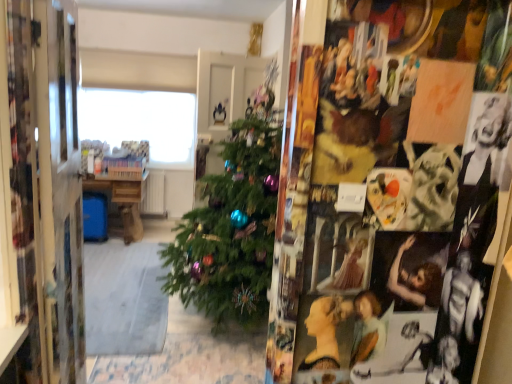
Based on the photo, measure the distance between point (138, 134) and camera.

16.27 feet.

Measure the distance between point (115,192) and camera.

The distance of point (115,192) from camera is 4.50 meters.

This screenshot has height=384, width=512. In order to click on transparent glass window at upper center in this screenshot , I will do `click(142, 122)`.

The image size is (512, 384). Find the location of `table behind the metallic silver mirror at left`. table behind the metallic silver mirror at left is located at coordinates (123, 200).

Would you say metallic silver mirror at left is a long distance from wooden table at center?

metallic silver mirror at left is positioned a significant distance from wooden table at center.

Considering the relative sizes of metallic silver mirror at left and wooden table at center in the image provided, is metallic silver mirror at left wider than wooden table at center?

In fact, metallic silver mirror at left might be narrower than wooden table at center.

From the image's perspective, between metallic silver mirror at left and wooden table at center, which one is located above?

metallic silver mirror at left, from the image's perspective.

Between wooden table at center and transparent glass window at upper center, which one has larger width?

wooden table at center.

In order to click on window in front of the wooden table at center in this screenshot , I will do `click(142, 122)`.

Who is smaller, wooden table at center or transparent glass window at upper center?

With smaller size is transparent glass window at upper center.

Is transparent glass window at upper center facing away from wooden table at center?

transparent glass window at upper center does not have its back to wooden table at center.

From the image's perspective, between transparent glass window at upper center and wooden table at center, who is located below?

wooden table at center, from the image's perspective.

Between transparent glass window at upper center and wooden table at center, which one appears on the right side from the viewer's perspective?

transparent glass window at upper center.

At what (x,y) coordinates should I click in order to perform the action: click on table below the transparent glass window at upper center (from the image's perspective). Please return your answer as a coordinate pair (x, y). This screenshot has height=384, width=512. Looking at the image, I should click on (123, 200).

From a real-world perspective, which object stands above the other?

From a 3D spatial view, transparent glass window at upper center is above.

Is metallic silver mirror at left positioned far away from transparent glass window at upper center?

Yes, metallic silver mirror at left and transparent glass window at upper center are located far from each other.

From the image's perspective, which object appears higher, metallic silver mirror at left or transparent glass window at upper center?

transparent glass window at upper center, from the image's perspective.

Could you tell me if wooden table at center is turned towards metallic silver mirror at left?

Yes, wooden table at center is oriented towards metallic silver mirror at left.

From a real-world perspective, which is physically above, wooden table at center or metallic silver mirror at left?

In real-world perspective, metallic silver mirror at left is above.

What's the angular difference between wooden table at center and metallic silver mirror at left's facing directions?

They differ by 95.7 degrees in their facing directions.

Considering the sizes of objects wooden table at center and metallic silver mirror at left in the image provided, who is thinner, wooden table at center or metallic silver mirror at left?

metallic silver mirror at left is thinner.

Which object is closer to the camera taking this photo, transparent glass window at upper center or metallic silver mirror at left?

metallic silver mirror at left is closer to the camera.

Is transparent glass window at upper center oriented towards metallic silver mirror at left?

Yes, transparent glass window at upper center is facing metallic silver mirror at left.

Considering the sizes of transparent glass window at upper center and metallic silver mirror at left in the image, is transparent glass window at upper center bigger or smaller than metallic silver mirror at left?

In the image, transparent glass window at upper center appears to be smaller than metallic silver mirror at left.

Find the location of a particular element. The width and height of the screenshot is (512, 384). table below the metallic silver mirror at left (from a real-world perspective) is located at coordinates (123, 200).

Locate an element on the screen. Image resolution: width=512 pixels, height=384 pixels. table that appears behind the transparent glass window at upper center is located at coordinates (123, 200).

Based on their spatial positions, is metallic silver mirror at left or wooden table at center closer to transparent glass window at upper center?

wooden table at center is positioned closer to the anchor transparent glass window at upper center.

Considering their positions, is transparent glass window at upper center positioned further to wooden table at center than metallic silver mirror at left?

Based on the image, metallic silver mirror at left appears to be further to wooden table at center.

From the image, which object appears to be nearer to metallic silver mirror at left, transparent glass window at upper center or wooden table at center?

The object closer to metallic silver mirror at left is wooden table at center.

When comparing their distances from wooden table at center, does metallic silver mirror at left or transparent glass window at upper center seem further?

metallic silver mirror at left is positioned further to the anchor wooden table at center.

From the image, which object appears to be farther from metallic silver mirror at left, wooden table at center or transparent glass window at upper center?

transparent glass window at upper center lies further to metallic silver mirror at left than the other object.

When comparing their distances from transparent glass window at upper center, does wooden table at center or metallic silver mirror at left seem closer?

wooden table at center.

Locate an element on the screen. window between metallic silver mirror at left and wooden table at center in the front-back direction is located at coordinates (142, 122).